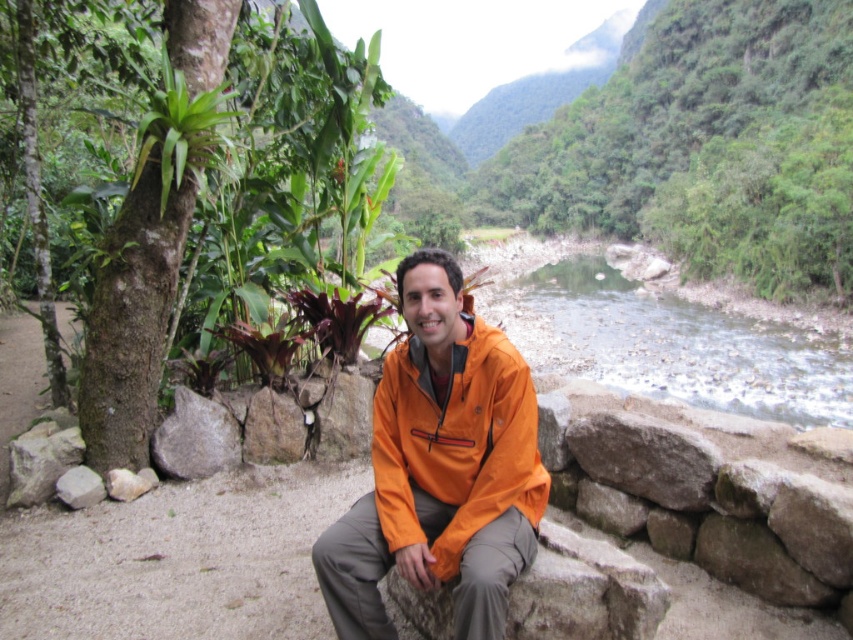
You are a hiker who wants to cross the river. You see the orange waterproof jacket at center and the clear water at river right. Which object is closer to the ground?

The orange waterproof jacket at center is below clear water at river right, so the orange waterproof jacket at center is closer to the ground.

Based on the photo, you are planning to cross the river using a small raft that can only carry items narrower than the orange waterproof jacket at center. Can you safely carry the clear water at river right on the raft?

The orange waterproof jacket at center has a lesser width compared to clear water at river right. Since the clear water at river right is wider than the jacket, it might exceed the raft capacity. Therefore, you cannot safely carry the clear water at river right on the raft.

You are planning to cross the river using a small boat. The boat can only carry you and one item. You have the orange waterproof jacket at center and the clear water at river right. Which item should you prioritize bringing with you?

The orange waterproof jacket at center should be prioritized because it is positioned to the left of clear water at river right, making it more accessible for retrieval before reaching the water.